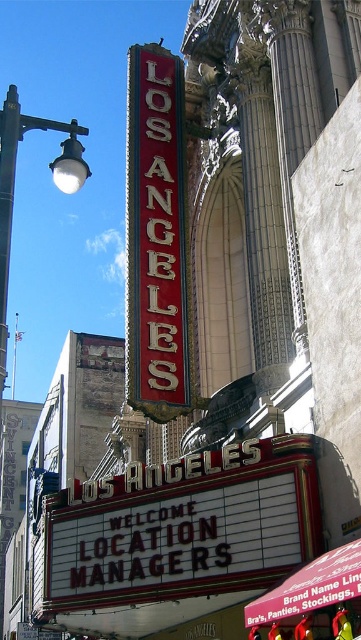
Between red enamel sign at upper center and white metal streetlight at upper left, which one is positioned higher?

Positioned higher is white metal streetlight at upper left.

Can you confirm if red enamel sign at upper center is positioned above white metal streetlight at upper left?

No.

Is point (164, 388) farther from viewer compared to point (54, 164)?

Yes.

Identify the location of red enamel sign at upper center. This screenshot has width=361, height=640. (155, 236).